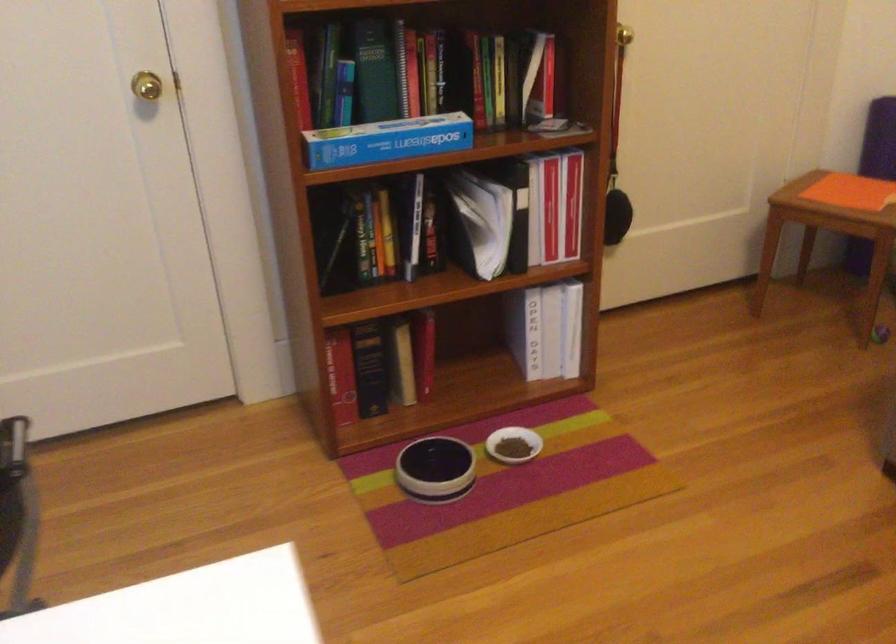
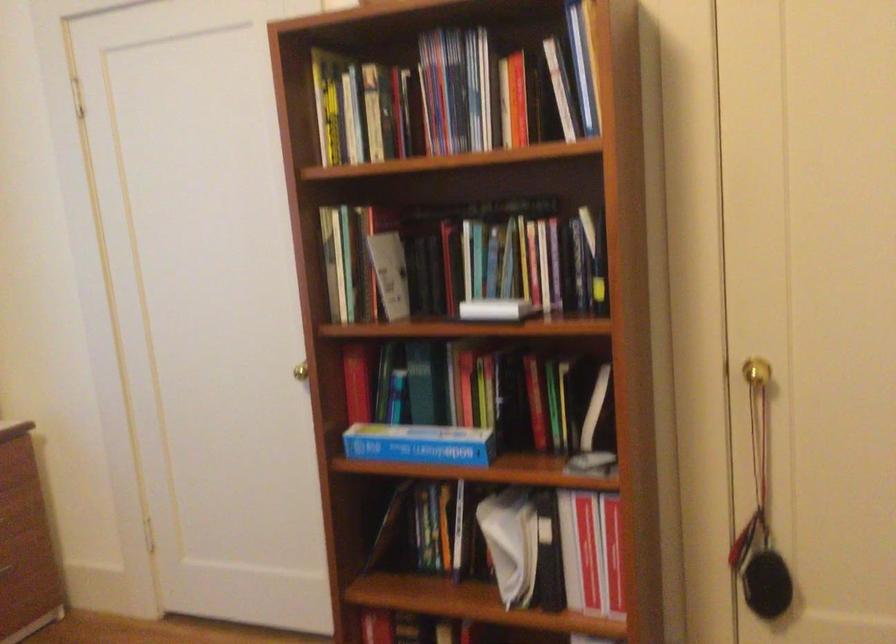
Locate, in the second image, the point that corresponds to (401,135) in the first image.

(419, 444)